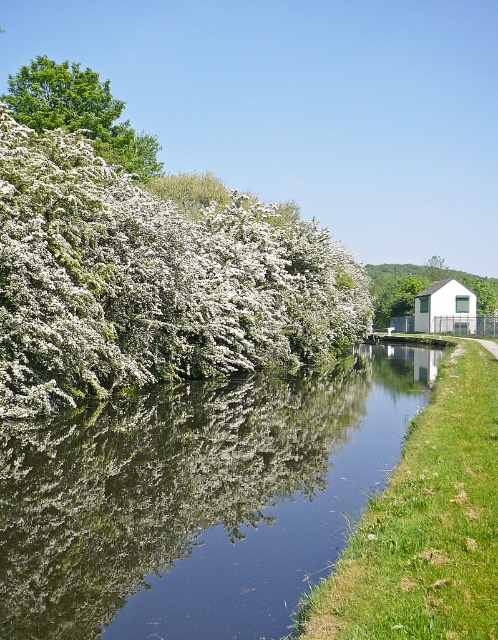
You are a drone operator flying over a canal. You see the white fluffy bush at left and the white matte house at right. Which object is closer to the left bank of the canal?

The white fluffy bush at left is positioned on the left side of the white matte house at right, so it is closer to the left bank of the canal.

You are standing at the edge of the canal near the white building on the right. You want to cross to the left side where the blossoms are. Is there a direct path across the green reflective water at center? Please explain your reasoning.

The green reflective water at center is located at point coordinates of (196,499). Since the water is in the center of the canal, there is no direct path across the water to the left side from the white building on the right. You would need to go around the canal or find a bridge.